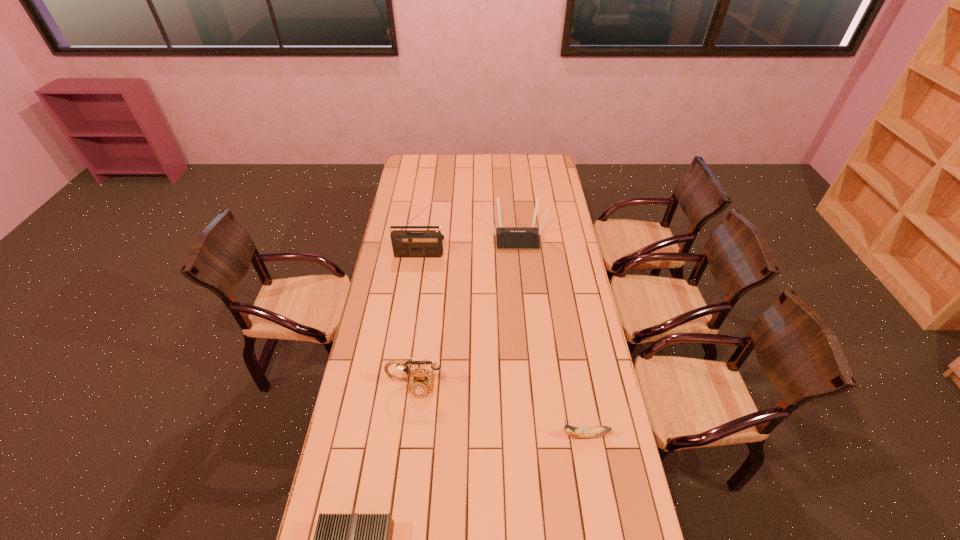
At what (x,y) coordinates should I click in order to perform the action: click on the tallest object. Please return your answer as a coordinate pair (x, y). Looking at the image, I should click on (406, 243).

Identify the location of the fourth shortest object. The width and height of the screenshot is (960, 540). (507, 237).

You are a GUI agent. You are given a task and a screenshot of the screen. Output one action in this format:
    pyautogui.click(x=<x>, y=<y>)
    Task: Click on the right router
    The height and width of the screenshot is (540, 960).
    Given the screenshot: What is the action you would take?
    pyautogui.click(x=507, y=237)

Where is `the third nearest object`? The height and width of the screenshot is (540, 960). the third nearest object is located at coordinates (421, 381).

You are a GUI agent. You are given a task and a screenshot of the screen. Output one action in this format:
    pyautogui.click(x=<x>, y=<y>)
    Task: Click on the telephone
    This screenshot has width=960, height=540.
    Given the screenshot: What is the action you would take?
    pyautogui.click(x=421, y=381)

This screenshot has width=960, height=540. Identify the location of the second nearest object. (578, 432).

I want to click on free region located on the front-facing side of the tallest object, so click(x=420, y=268).

The image size is (960, 540). What are the coordinates of `blank space located on the front-facing side of the second tallest object` in the screenshot? It's located at (522, 296).

Where is `vacant space positioned on the dial number of the third nearest object`? vacant space positioned on the dial number of the third nearest object is located at coordinates (408, 442).

This screenshot has height=540, width=960. I want to click on free spot located on the peel of the fourth farthest object, so click(x=478, y=435).